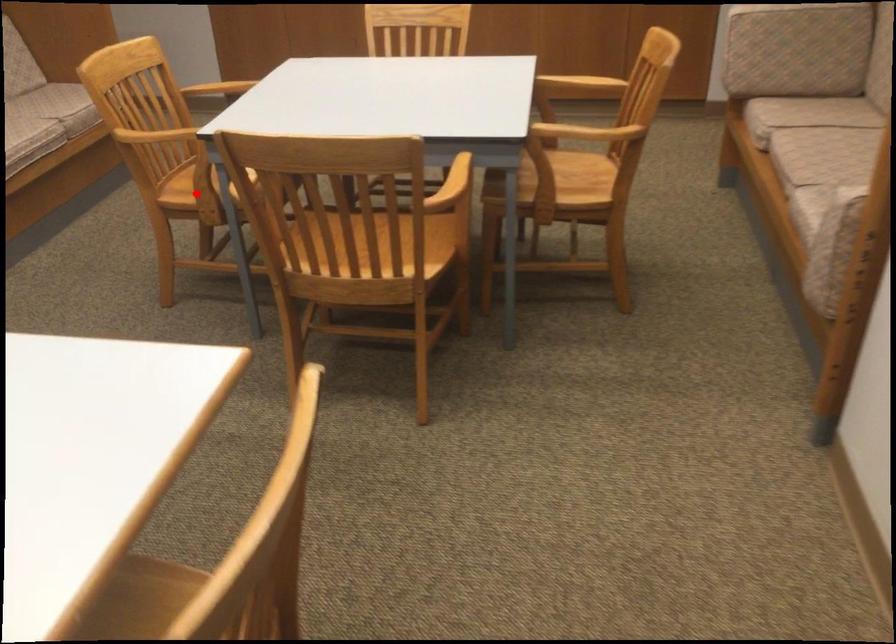
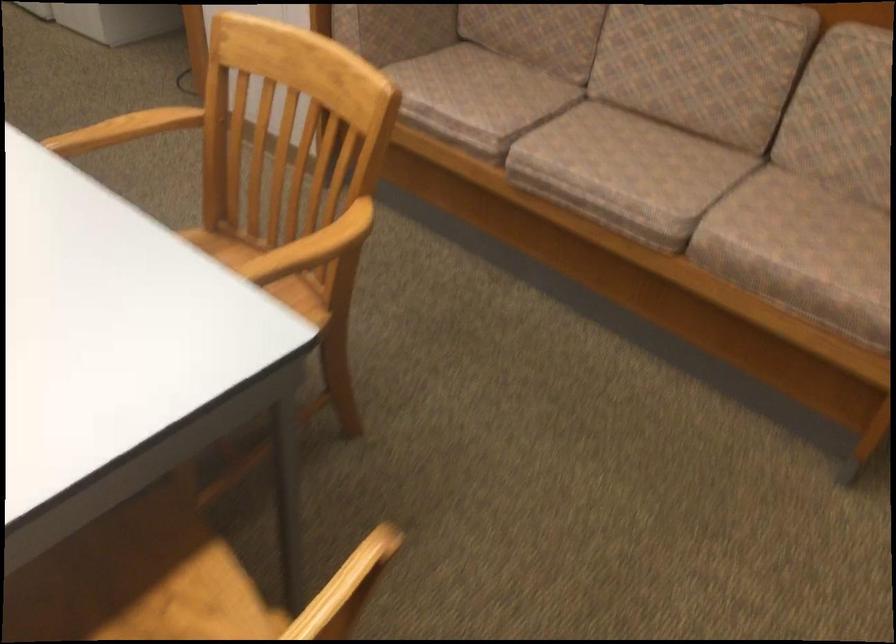
Question: I am providing you with two images of the same scene from different viewpoints. A red point is marked on the first image. Is the red point's position out of view in image 2?

Choices:
 (A) Yes
 (B) No

Answer: (A)